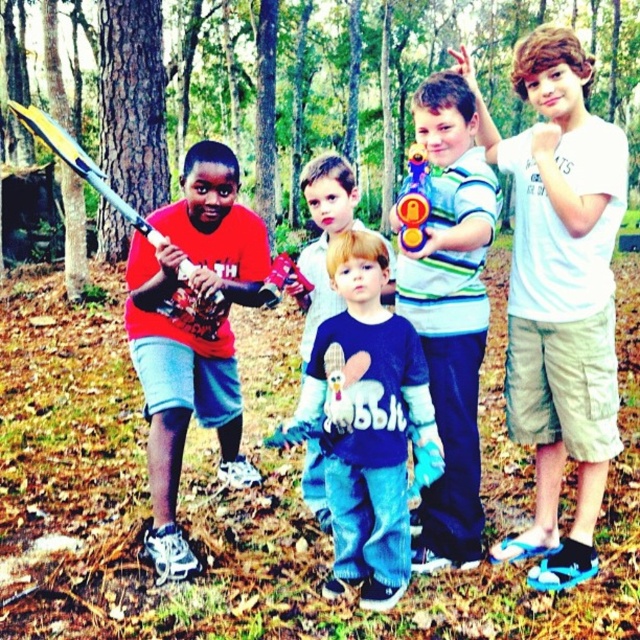
You are a parent trying to organize toys in the garage. You have two items to place on a shelf that can only hold items up to 1 meter in height. The striped jersey toy gun at center and the yellow plastic baseball bat at left are the items. Based on their heights, can both items fit on the shelf?

The striped jersey toy gun at center has a lesser height compared to the yellow plastic baseball bat at left. Since the shelf can hold items up to 1 meter, both items can fit as long as the taller item, the yellow plastic baseball bat at left, is under 1 meter in height. However, the exact height of the baseball bat is not provided, so we cannot confirm if it fits.

You are a parent supervising the children in the wooded area. You notice the yellow plastic baseball bat at left and the translucent plastic toy gun at center. Which toy is positioned higher in the image?

The yellow plastic baseball bat at left is positioned higher than the translucent plastic toy gun at center in the image.